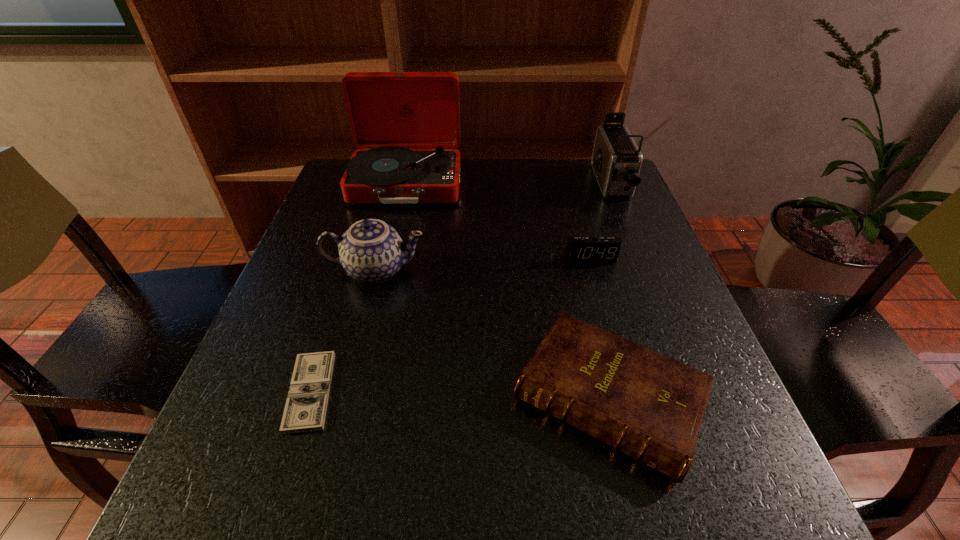
In order to click on the tallest object in this screenshot , I will do `click(407, 124)`.

Where is `camcorder`? This screenshot has width=960, height=540. camcorder is located at coordinates (616, 160).

You are a GUI agent. You are given a task and a screenshot of the screen. Output one action in this format:
    pyautogui.click(x=<x>, y=<y>)
    Task: Click on the third tallest object
    The image size is (960, 540).
    Given the screenshot: What is the action you would take?
    click(371, 251)

Where is `alarm clock`? alarm clock is located at coordinates (579, 249).

Locate an element on the screen. The image size is (960, 540). hardback book is located at coordinates (648, 406).

The image size is (960, 540). Find the location of `dollar`. dollar is located at coordinates (305, 409).

Where is `blank space located 0.200m on the front-facing side of the tallest object`? This screenshot has width=960, height=540. blank space located 0.200m on the front-facing side of the tallest object is located at coordinates (388, 262).

Locate an element on the screen. vacant space located at the lens of the camcorder is located at coordinates (634, 240).

Identify the location of free region located from the spout of the third tallest object. (496, 270).

This screenshot has height=540, width=960. In order to click on vacant space located on the front-facing side of the alarm clock in this screenshot , I will do `click(636, 423)`.